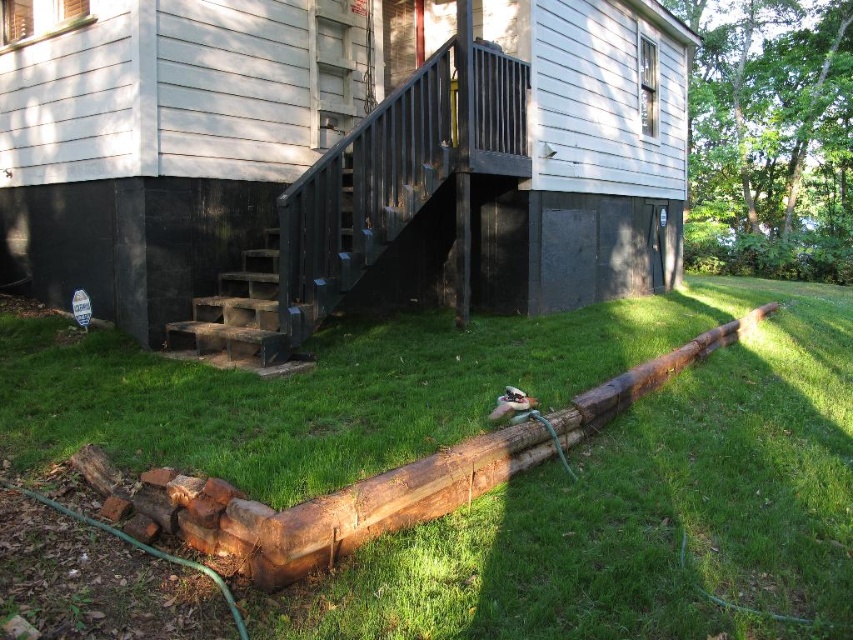
Who is positioned more to the left, green grass at lower left or dark gray concrete stairs at lower left?

dark gray concrete stairs at lower left is more to the left.

Who is more forward, (482, 595) or (276, 284)?

Point (482, 595) is more forward.

This screenshot has width=853, height=640. I want to click on green grass at lower left, so click(519, 477).